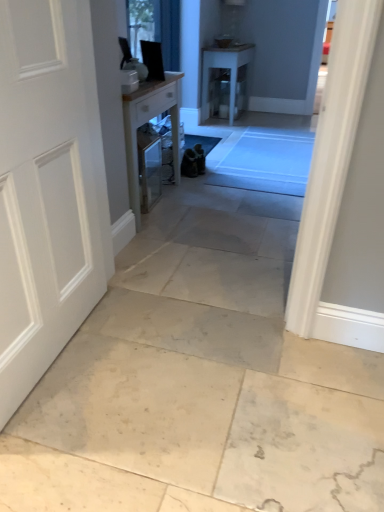
This screenshot has height=512, width=384. I want to click on free spot in front of white matte door at left, so click(x=77, y=434).